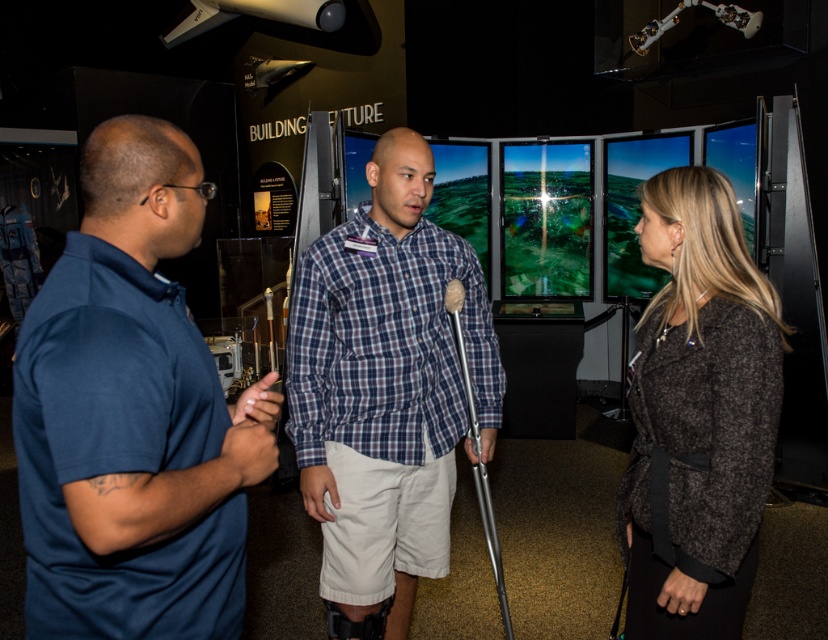
Question: Which of the following is the farthest from the observer?

Choices:
 (A) (460, 321)
 (B) (672, 474)
 (C) (113, 632)
 (D) (499, 394)

Answer: (D)

Question: Estimate the real-world distances between objects in this image. Which object is farther from the blue cotton polo shirt at left?

Choices:
 (A) blue plaid shirt at center
 (B) dark gray woolen jacket at center
 (C) silver metallic crutch at center

Answer: (B)

Question: Which point is closer to the camera?

Choices:
 (A) (764, 307)
 (B) (400, 474)
 (C) (468, 428)

Answer: (A)

Question: Does blue cotton polo shirt at left appear over silver metallic crutch at center?

Choices:
 (A) yes
 (B) no

Answer: (A)

Question: Is blue cotton polo shirt at left smaller than blue plaid shirt at center?

Choices:
 (A) no
 (B) yes

Answer: (B)

Question: Does blue plaid shirt at center come in front of dark gray woolen jacket at center?

Choices:
 (A) yes
 (B) no

Answer: (B)